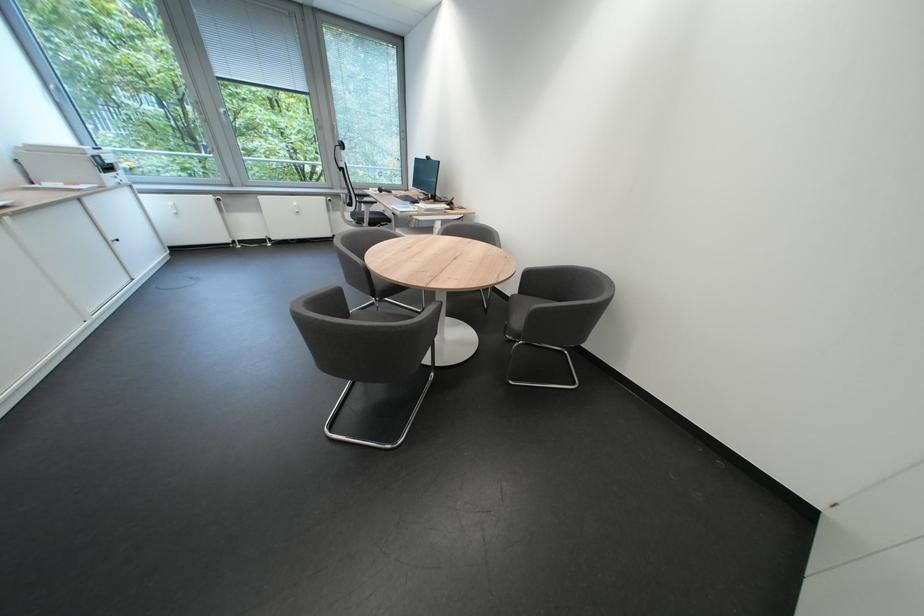
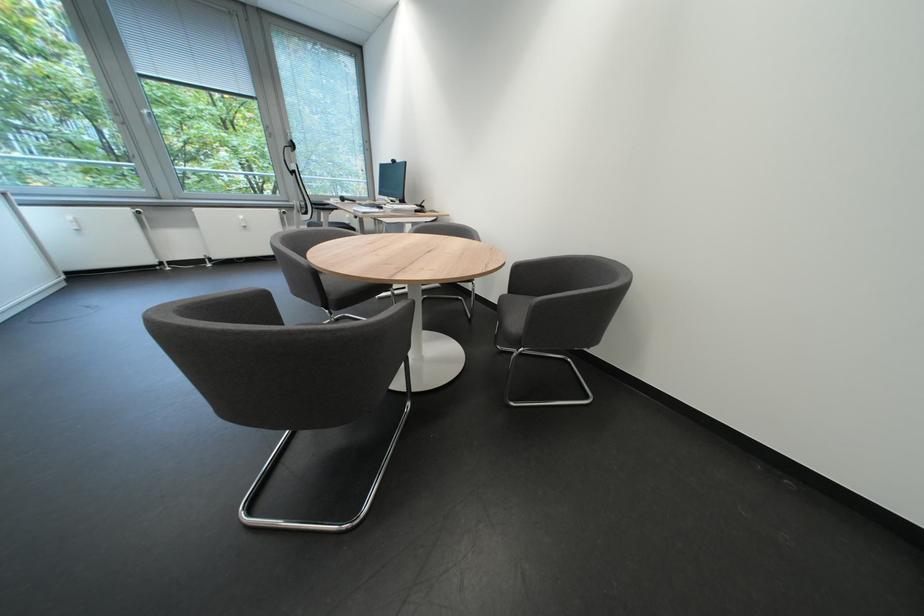
Question: The camera is either moving clockwise (left) or counter-clockwise (right) around the object. The first image is from the beginning of the video and the second image is from the end. Is the camera moving left or right when shooting the video?

Choices:
 (A) Left
 (B) Right

Answer: (A)